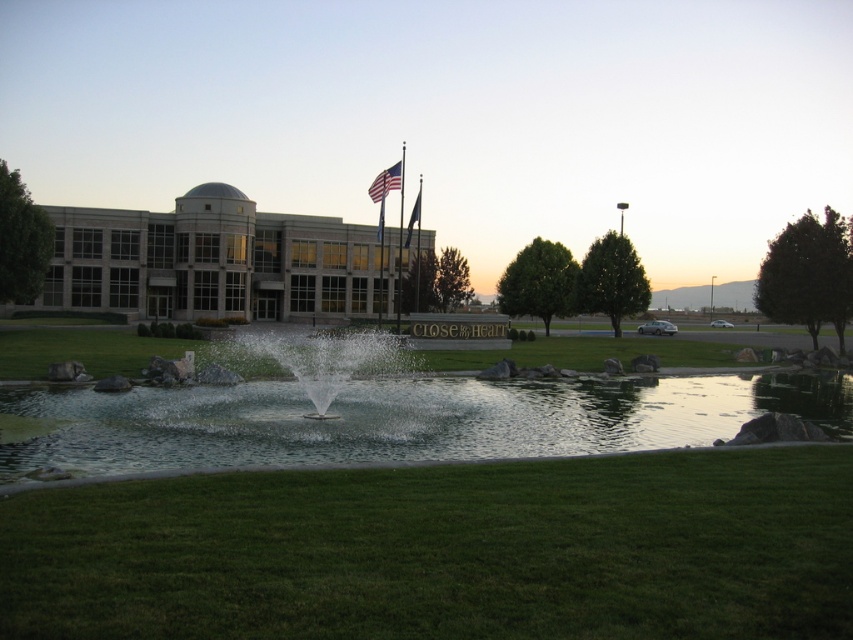
In the scene shown: You are a photographer trying to capture both the american flag at upper center and the blue fabric flag at upper center in the same frame. Given their sizes, which flag will appear larger in your photo?

The american flag at upper center will appear larger in the photo since it is bigger than the blue fabric flag at upper center according to the description.

You are standing in the outdoor area and want to take a photo of the metallic flag pole at center and the clear water at center. Which object is positioned lower in the scene?

The clear water at center is located below the metallic flag pole at center, so it is positioned lower in the scene.

You are a photographer planning to capture the sunset at the pond. You notice the american flag at upper center and the blue fabric flag at upper center. Which flag is closer to the camera?

The american flag at upper center is positioned over the blue fabric flag at upper center, so it is closer to the camera.